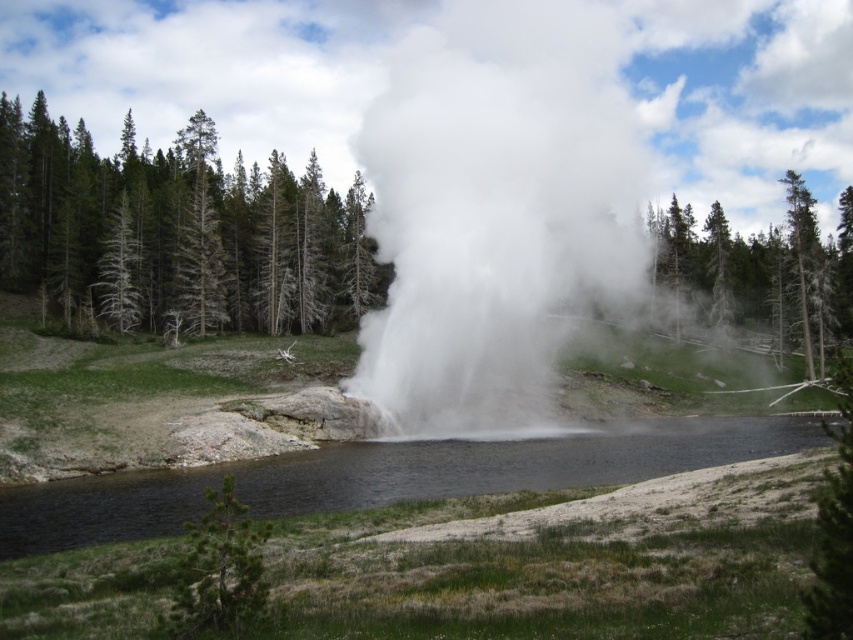
You are standing at the point with coordinates point (178, 232). What object is located exactly at your current position?

The green textured tree at center is located exactly at point (178, 232).

You are standing in the grassy area near the erupting geyser and want to take a photo of the green textured tree at center and the green leafy tree at upper center. Which tree will appear larger in your photo?

The green textured tree at center will appear larger in the photo because it is closer to you than the green leafy tree at upper center.